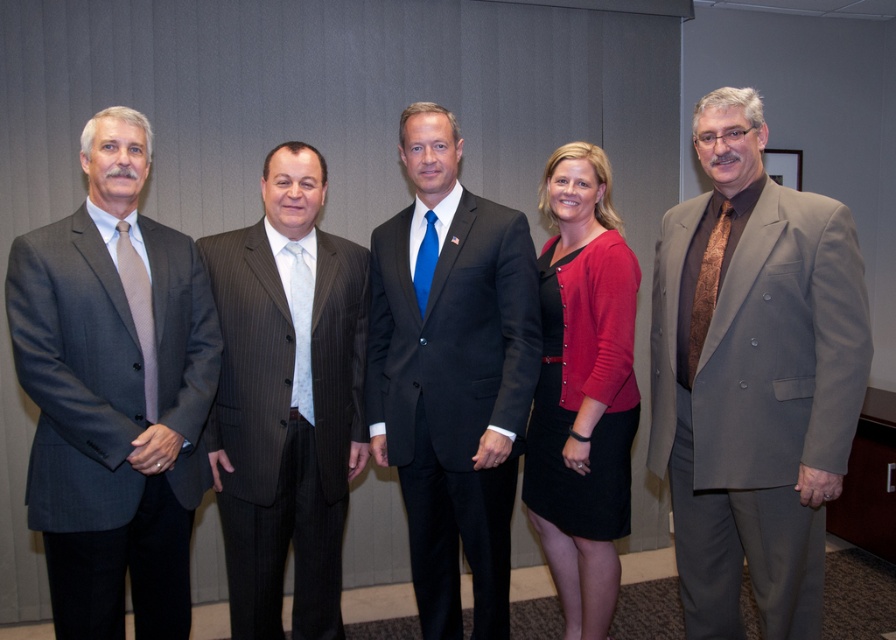
Question: Is matte gray suit at left smaller than dark gray suit at center?

Choices:
 (A) no
 (B) yes

Answer: (B)

Question: Which of the following is the closest to the observer?

Choices:
 (A) (541, 195)
 (B) (366, 392)
 (C) (20, 284)
 (D) (726, 609)

Answer: (C)

Question: Can you confirm if matte gray suit at right is positioned below dark gray suit at center?

Choices:
 (A) yes
 (B) no

Answer: (B)

Question: Which of these objects is positioned farthest from the dark gray suit at center?

Choices:
 (A) matte gray suit at right
 (B) matte red cardigan at center
 (C) pinstriped suit at center

Answer: (A)

Question: Which object appears farthest from the camera in this image?

Choices:
 (A) matte gray suit at left
 (B) dark gray suit at center
 (C) matte red cardigan at center

Answer: (C)

Question: Is matte gray suit at left above pinstriped suit at center?

Choices:
 (A) no
 (B) yes

Answer: (B)